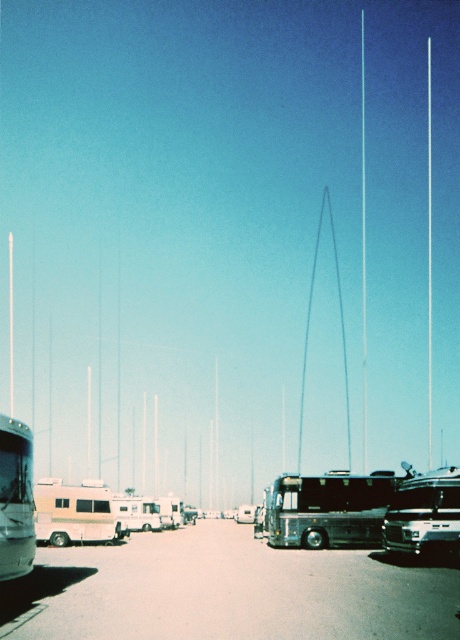
Question: Can you confirm if beige vinyl camper at center is thinner than metallic silver car at center?

Choices:
 (A) no
 (B) yes

Answer: (A)

Question: Does metallic silver bus at left have a lesser width compared to silver metallic bus at center?

Choices:
 (A) yes
 (B) no

Answer: (A)

Question: Which is nearer to the metallic silver bus at center?

Choices:
 (A) silver metallic bus at center
 (B) shiny black bus at center
 (C) metallic silver car at center
 (D) shiny silver bus at center

Answer: (B)

Question: Does metallic silver bus at center appear over silver metallic bus at center?

Choices:
 (A) no
 (B) yes

Answer: (B)

Question: Which of the following is the closest to the observer?

Choices:
 (A) (15, 556)
 (B) (243, 508)
 (C) (426, 483)

Answer: (A)

Question: Which point is farther to the camera?

Choices:
 (A) (176, 525)
 (B) (316, 516)

Answer: (A)